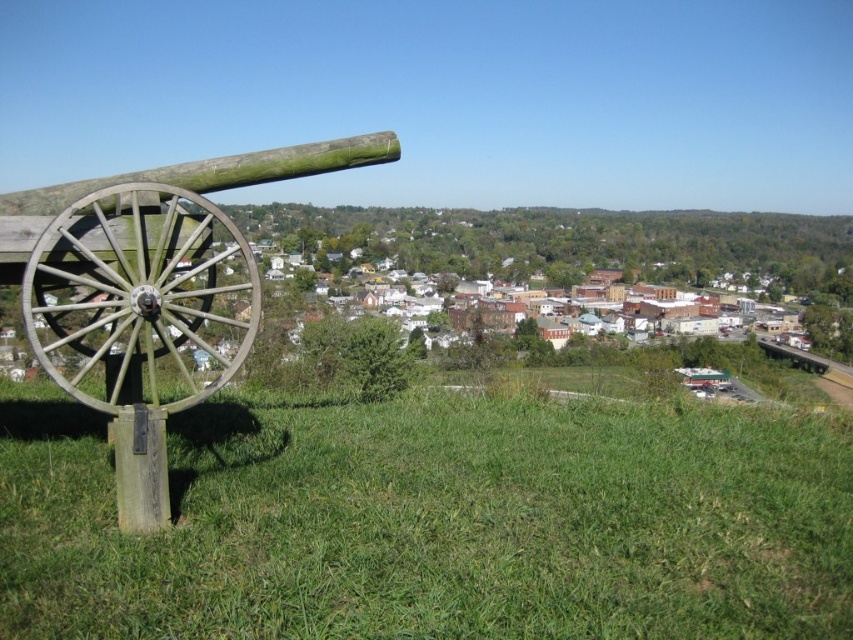
Does green grassy field at lower left lie behind green wood cannon at left?

That is True.

Where is `green grassy field at lower left`? green grassy field at lower left is located at coordinates (433, 520).